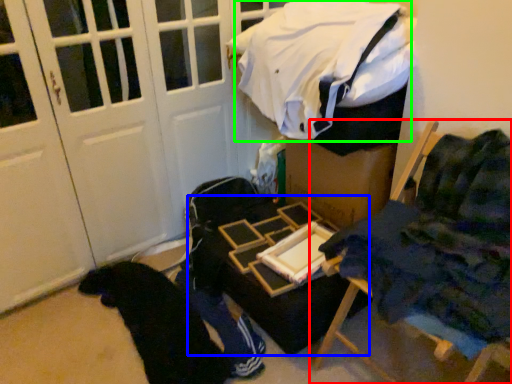
Question: Which object is the closest to the furniture (highlighted by a red box)? Choose among these: table (highlighted by a blue box) or laundry (highlighted by a green box).

Choices:
 (A) table
 (B) laundry

Answer: (A)